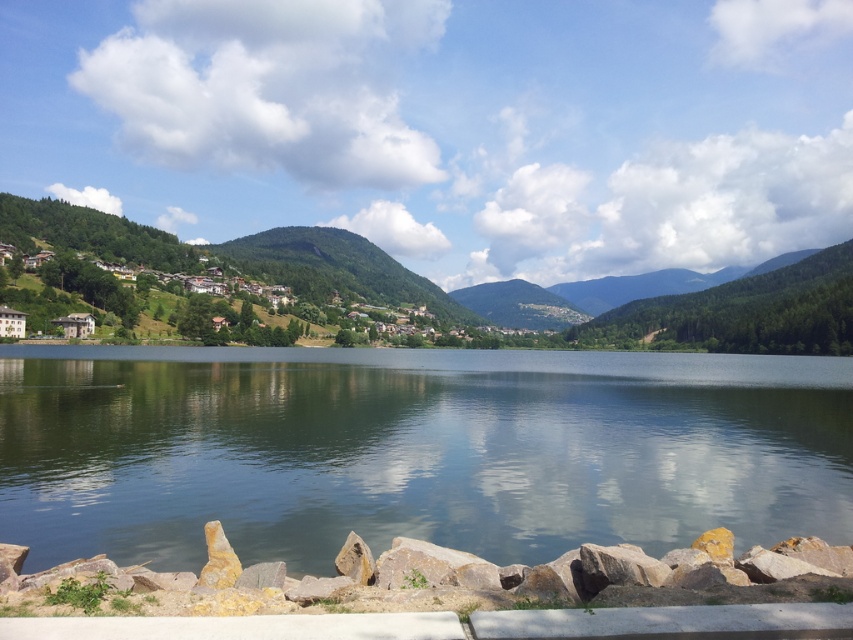
Question: Is smooth water at center further to the viewer compared to green forested mountain at left?

Choices:
 (A) no
 (B) yes

Answer: (A)

Question: Does smooth water at center appear on the left side of green forested mountain at left?

Choices:
 (A) yes
 (B) no

Answer: (A)

Question: Which of the following is the farthest from the observer?

Choices:
 (A) (289, 234)
 (B) (22, 493)

Answer: (A)

Question: Among these objects, which one is farthest from the camera?

Choices:
 (A) green forested mountain at left
 (B) smooth water at center

Answer: (A)

Question: Which point is closer to the camera taking this photo?

Choices:
 (A) (20, 362)
 (B) (169, 237)

Answer: (A)

Question: Observing the image, what is the correct spatial positioning of smooth water at center in reference to green forested mountain at left?

Choices:
 (A) below
 (B) above

Answer: (A)